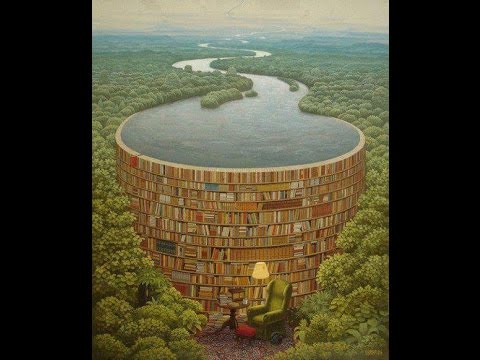
The image size is (480, 360). In order to click on pillar in this screenshot , I will do `click(220, 317)`.